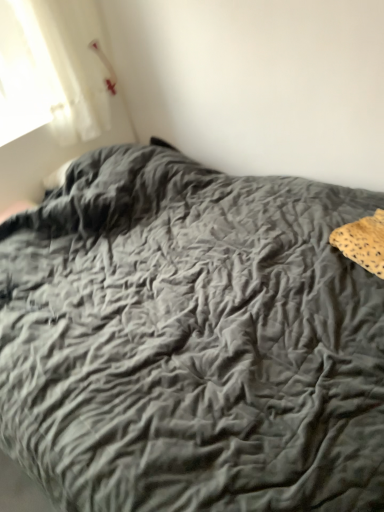
What do you see at coordinates (191, 341) in the screenshot? This screenshot has height=512, width=384. I see `velvet gray bedspread at center` at bounding box center [191, 341].

Where is `velvet gray bedspread at center`? This screenshot has width=384, height=512. velvet gray bedspread at center is located at coordinates (191, 341).

Image resolution: width=384 pixels, height=512 pixels. What do you see at coordinates (363, 242) in the screenshot? I see `leopard print fabric at right` at bounding box center [363, 242].

What are the coordinates of `leopard print fabric at right` in the screenshot? It's located at (363, 242).

I want to click on velvet gray bedspread at center, so click(x=191, y=341).

Is velvet gray bedspread at center at the right side of leopard print fabric at right?

No, velvet gray bedspread at center is not to the right of leopard print fabric at right.

Which object is closer to the camera, velvet gray bedspread at center or leopard print fabric at right?

velvet gray bedspread at center is in front.

Is point (367, 201) closer to viewer compared to point (344, 252)?

That is False.

From the image's perspective, is velvet gray bedspread at center over leopard print fabric at right?

No.

From a real-world perspective, which object rests below the other?

velvet gray bedspread at center.

Which of these two, velvet gray bedspread at center or leopard print fabric at right, is wider?

With larger width is velvet gray bedspread at center.

Does velvet gray bedspread at center have a greater height compared to leopard print fabric at right?

Yes, velvet gray bedspread at center is taller than leopard print fabric at right.

Can you confirm if velvet gray bedspread at center is smaller than leopard print fabric at right?

Incorrect, velvet gray bedspread at center is not smaller in size than leopard print fabric at right.

Is leopard print fabric at right a part of velvet gray bedspread at center?

Yes, leopard print fabric at right is inside velvet gray bedspread at center.

Are velvet gray bedspread at center and leopard print fabric at right far apart?

No, velvet gray bedspread at center is not far from leopard print fabric at right.

Based on the photo, is velvet gray bedspread at center facing away from leopard print fabric at right?

velvet gray bedspread at center is not turned away from leopard print fabric at right.

At what (x,y) coordinates should I click in order to perform the action: click on material positioned vertically above the velvet gray bedspread at center (from a real-world perspective). Please return your answer as a coordinate pair (x, y). The width and height of the screenshot is (384, 512). Looking at the image, I should click on (363, 242).

Between leopard print fabric at right and velvet gray bedspread at center, which one appears on the left side from the viewer's perspective?

Positioned to the left is velvet gray bedspread at center.

Consider the image. Which is behind, leopard print fabric at right or velvet gray bedspread at center?

leopard print fabric at right is further away from the camera.

Is point (336, 231) positioned after point (73, 450)?

Yes.

From the image's perspective, who appears lower, leopard print fabric at right or velvet gray bedspread at center?

velvet gray bedspread at center.

From a real-world perspective, who is located higher, leopard print fabric at right or velvet gray bedspread at center?

leopard print fabric at right.

Considering the sizes of leopard print fabric at right and velvet gray bedspread at center in the image, is leopard print fabric at right wider or thinner than velvet gray bedspread at center?

Considering their sizes, leopard print fabric at right looks slimmer than velvet gray bedspread at center.

Considering the sizes of leopard print fabric at right and velvet gray bedspread at center in the image, is leopard print fabric at right taller or shorter than velvet gray bedspread at center?

In the image, leopard print fabric at right appears to be shorter than velvet gray bedspread at center.

Between leopard print fabric at right and velvet gray bedspread at center, which one has smaller size?

With smaller size is leopard print fabric at right.

Can velvet gray bedspread at center be found inside leopard print fabric at right?

No, velvet gray bedspread at center is not surrounded by leopard print fabric at right.

Is leopard print fabric at right touching velvet gray bedspread at center?

There is a gap between leopard print fabric at right and velvet gray bedspread at center.

Could you tell me if leopard print fabric at right is facing velvet gray bedspread at center?

Yes.

Can you tell me how much leopard print fabric at right and velvet gray bedspread at center differ in facing direction?

There is a 20.5-degree angle between the facing directions of leopard print fabric at right and velvet gray bedspread at center.

Locate an element on the screen. The image size is (384, 512). material that appears on the right of velvet gray bedspread at center is located at coordinates (363, 242).

At what (x,y) coordinates should I click in order to perform the action: click on material located above the velvet gray bedspread at center (from a real-world perspective). Please return your answer as a coordinate pair (x, y). This screenshot has width=384, height=512. Looking at the image, I should click on (363, 242).

Find the location of a particular element. This screenshot has height=512, width=384. material located behind the velvet gray bedspread at center is located at coordinates (363, 242).